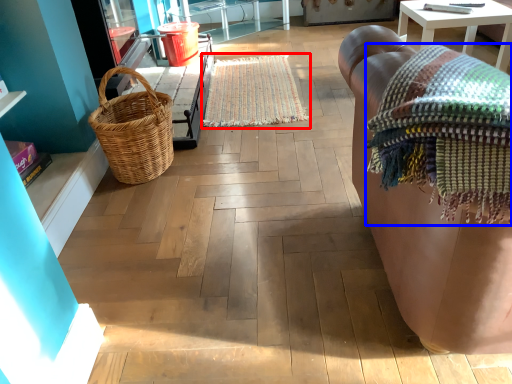
Question: Among these objects, which one is nearest to the camera, mat (highlighted by a red box) or blanket (highlighted by a blue box)?

Choices:
 (A) mat
 (B) blanket

Answer: (B)